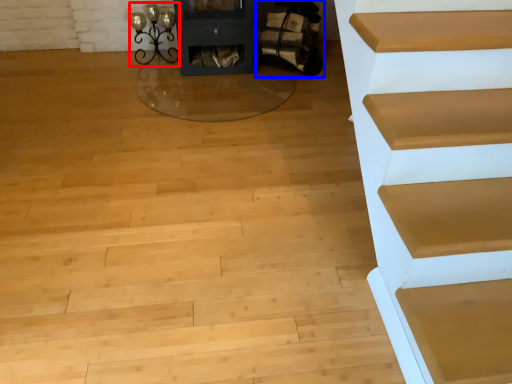
Question: Which point is further to the camera, light (highlighted by a red box) or chair (highlighted by a blue box)?

Choices:
 (A) light
 (B) chair

Answer: (A)